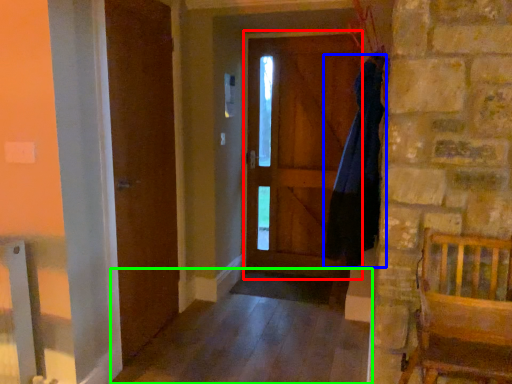
Question: Which is farther away from screen door (highlighted by a red box)? dress (highlighted by a blue box) or alley (highlighted by a green box)?

Choices:
 (A) dress
 (B) alley

Answer: (A)